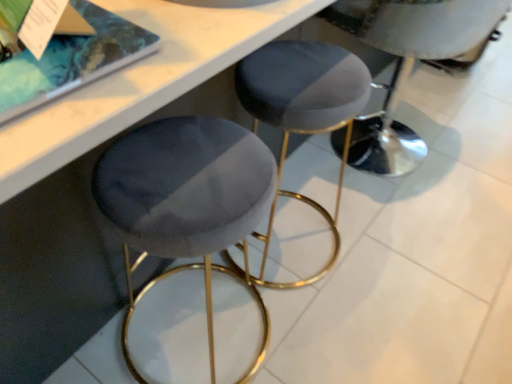
The image size is (512, 384). What do you see at coordinates (407, 63) in the screenshot?
I see `velvet grey stool at center` at bounding box center [407, 63].

Where is `velvet grey stool at center`? The height and width of the screenshot is (384, 512). velvet grey stool at center is located at coordinates (407, 63).

This screenshot has width=512, height=384. I want to click on velvet grey stool at center, so click(303, 110).

What is the approximate width of velvet grey stool at center?

It is 16.99 inches.

Describe the element at coordinates (303, 110) in the screenshot. I see `velvet grey stool at center` at that location.

You are a GUI agent. You are given a task and a screenshot of the screen. Output one action in this format:
    pyautogui.click(x=<x>, y=<y>)
    Task: Click on the velvet grey stool at center
    The height and width of the screenshot is (384, 512).
    Given the screenshot: What is the action you would take?
    pyautogui.click(x=407, y=63)

Between velvet grey stool at center and velvet grey stool at center, which one appears on the left side from the viewer's perspective?

velvet grey stool at center is more to the left.

Looking at this image, is the position of velvet grey stool at center less distant than that of velvet grey stool at center?

Yes, it is.

Between point (289, 49) and point (370, 149), which one is positioned in front?

Point (289, 49)

From the image's perspective, which one is positioned lower, velvet grey stool at center or velvet grey stool at center?

velvet grey stool at center.

From a real-world perspective, which is physically above, velvet grey stool at center or velvet grey stool at center?

velvet grey stool at center is physically above.

Looking at their sizes, would you say velvet grey stool at center is wider or thinner than velvet grey stool at center?

Clearly, velvet grey stool at center has less width compared to velvet grey stool at center.

Between velvet grey stool at center and velvet grey stool at center, which one has more height?

velvet grey stool at center.

Based on the photo, between velvet grey stool at center and velvet grey stool at center, which one has larger size?

With larger size is velvet grey stool at center.

Is velvet grey stool at center surrounding velvet grey stool at center?

No, velvet grey stool at center is not inside velvet grey stool at center.

Are velvet grey stool at center and velvet grey stool at center located far from each other?

velvet grey stool at center is actually quite close to velvet grey stool at center.

Is velvet grey stool at center facing towards velvet grey stool at center?

No, velvet grey stool at center is not aimed at velvet grey stool at center.

At what (x,y) coordinates should I click in order to perform the action: click on swivel chair on the right of velvet grey stool at center. Please return your answer as a coordinate pair (x, y). Looking at the image, I should click on (407, 63).

Which object is positioned more to the left, velvet grey stool at center or velvet grey stool at center?

velvet grey stool at center is more to the left.

Which object is closer to the camera taking this photo, velvet grey stool at center or velvet grey stool at center?

velvet grey stool at center.

Which is less distant, (397, 34) or (287, 144)?

Point (397, 34) appears to be closer to the viewer than point (287, 144).

From the image's perspective, is velvet grey stool at center over velvet grey stool at center?

Indeed, from the image's perspective, velvet grey stool at center is shown above velvet grey stool at center.

From a real-world perspective, which is physically above, velvet grey stool at center or velvet grey stool at center?

velvet grey stool at center, from a real-world perspective.

Does velvet grey stool at center have a greater width compared to velvet grey stool at center?

Yes.

Between velvet grey stool at center and velvet grey stool at center, which one has less height?

Standing shorter between the two is velvet grey stool at center.

Can you confirm if velvet grey stool at center is smaller than velvet grey stool at center?

No.

Which is correct: velvet grey stool at center is inside velvet grey stool at center, or outside of it?

velvet grey stool at center cannot be found inside velvet grey stool at center.

Is there a large distance between velvet grey stool at center and velvet grey stool at center?

No, velvet grey stool at center is not far from velvet grey stool at center.

Is velvet grey stool at center facing away from velvet grey stool at center?

That's not correct — velvet grey stool at center is not looking away from velvet grey stool at center.

Can you tell me how much velvet grey stool at center and velvet grey stool at center differ in facing direction?

The facing directions of velvet grey stool at center and velvet grey stool at center are 4.19 degrees apart.

In the image, there is a velvet grey stool at center. Where is `stool below it (from the image's perspective)`? The image size is (512, 384). stool below it (from the image's perspective) is located at coordinates (303, 110).

At what (x,y) coordinates should I click in order to perform the action: click on stool beneath the velvet grey stool at center (from a real-world perspective). Please return your answer as a coordinate pair (x, y). The height and width of the screenshot is (384, 512). Looking at the image, I should click on (303, 110).

In order to click on swivel chair above the velvet grey stool at center (from the image's perspective) in this screenshot , I will do `click(407, 63)`.